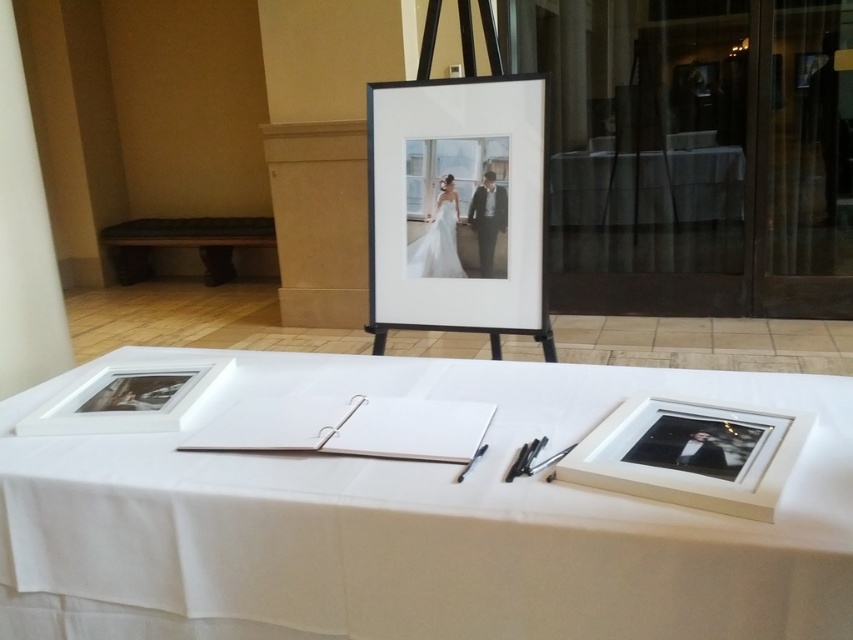
Question: Which of the following is the closest to the observer?

Choices:
 (A) green fabric bench at left
 (B) matte white frame at center
 (C) white paper at center
 (D) white satin dress at center

Answer: (C)

Question: In this image, where is black glossy photo frame at lower right located relative to green fabric bench at left?

Choices:
 (A) above
 (B) below

Answer: (B)

Question: Which point is closer to the camera?

Choices:
 (A) white matte picture frame at lower left
 (B) black glossy photo frame at lower right

Answer: (B)

Question: Which point is closer to the camera?

Choices:
 (A) [173, 230]
 (B) [432, 241]
 (C) [134, 406]

Answer: (C)

Question: In this image, where is white paper at center located relative to white matte picture frame at lower left?

Choices:
 (A) below
 (B) above

Answer: (A)

Question: Does matte white frame at center come behind black glossy photo frame at lower right?

Choices:
 (A) no
 (B) yes

Answer: (B)